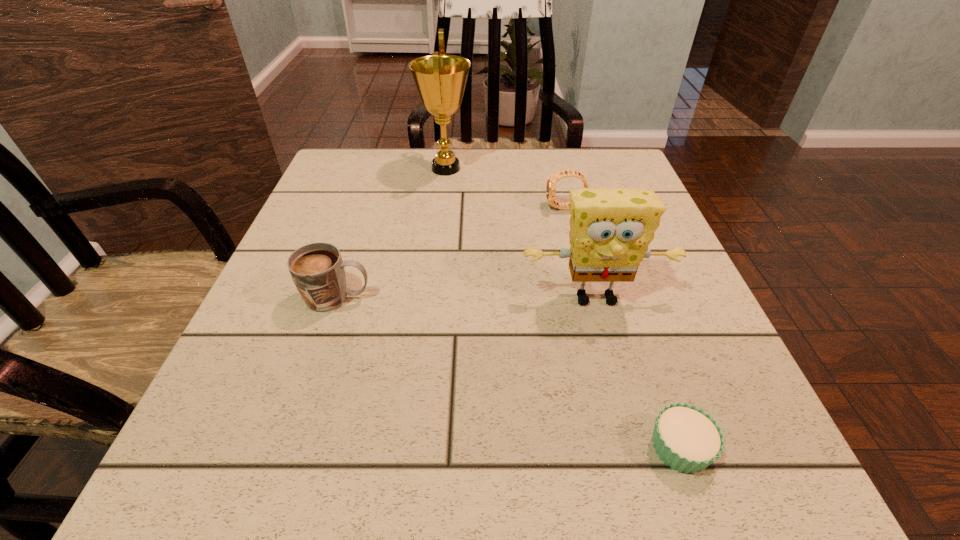
At what (x,y) coordinates should I click in order to perform the action: click on vacant space that satisfies the following two spatial constraints: 1. on the back side of the cupcake; 2. on the front view with handles of the fourth object from right to left. Please return your answer as a coordinate pair (x, y). The image size is (960, 540). Looking at the image, I should click on (585, 168).

Locate an element on the screen. The height and width of the screenshot is (540, 960). vacant area in the image that satisfies the following two spatial constraints: 1. on the face of the watch; 2. on the left side of the cupcake is located at coordinates (625, 447).

Where is `free space that satisfies the following two spatial constraints: 1. on the face of the nearest object; 2. on the left side of the sponge`? free space that satisfies the following two spatial constraints: 1. on the face of the nearest object; 2. on the left side of the sponge is located at coordinates (636, 447).

Locate an element on the screen. The width and height of the screenshot is (960, 540). free region that satisfies the following two spatial constraints: 1. on the back side of the nearest object; 2. on the front view with handles of the award is located at coordinates (585, 168).

Locate an element on the screen. vacant space that satisfies the following two spatial constraints: 1. on the front view with handles of the second object from left to right; 2. on the back side of the shortest object is located at coordinates (415, 447).

Locate an element on the screen. This screenshot has width=960, height=540. vacant space that satisfies the following two spatial constraints: 1. on the side of the leftmost object with the handle; 2. on the back side of the shortest object is located at coordinates (288, 447).

Where is `blank area in the image that satisfies the following two spatial constraints: 1. on the back side of the cupcake; 2. on the side of the leftmost object with the handle`? The width and height of the screenshot is (960, 540). blank area in the image that satisfies the following two spatial constraints: 1. on the back side of the cupcake; 2. on the side of the leftmost object with the handle is located at coordinates (629, 298).

Find the location of a particular element. This screenshot has height=540, width=960. vacant position in the image that satisfies the following two spatial constraints: 1. on the side of the shortest object with the handle; 2. on the left side of the mug is located at coordinates (288, 447).

Where is `vacant point that satisfies the following two spatial constraints: 1. on the face of the sponge; 2. on the side of the leftmost object with the handle`? This screenshot has height=540, width=960. vacant point that satisfies the following two spatial constraints: 1. on the face of the sponge; 2. on the side of the leftmost object with the handle is located at coordinates (595, 298).